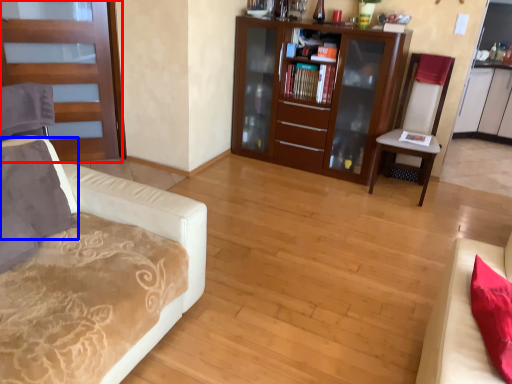
Question: Which object is further to the camera taking this photo, door (highlighted by a red box) or pillow (highlighted by a blue box)?

Choices:
 (A) door
 (B) pillow

Answer: (A)